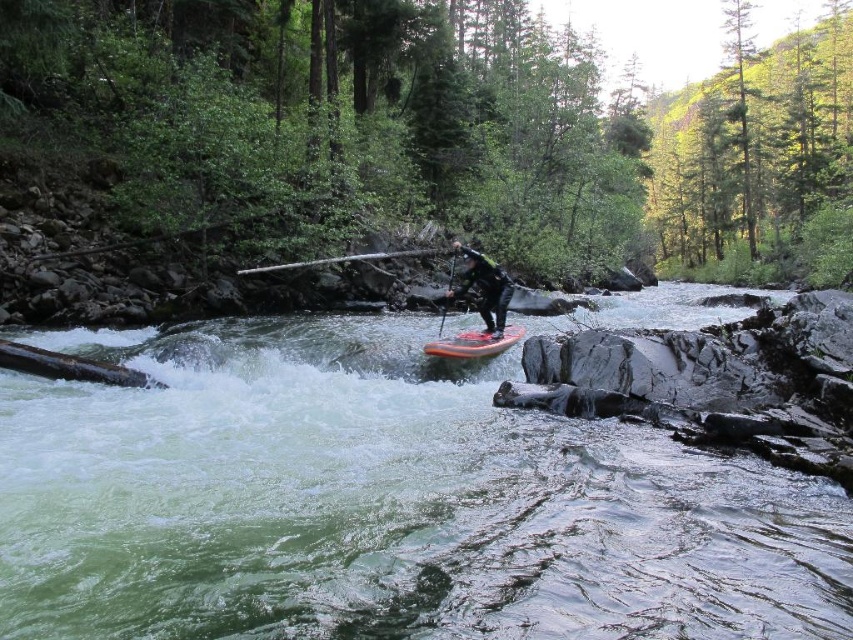
Describe the element at coordinates (485, 288) in the screenshot. I see `black rubber wetsuit at center` at that location.

Is black rubber wetsuit at center closer to the viewer compared to smooth wooden paddle at center?

Yes, black rubber wetsuit at center is in front of smooth wooden paddle at center.

You are a GUI agent. You are given a task and a screenshot of the screen. Output one action in this format:
    pyautogui.click(x=<x>, y=<y>)
    Task: Click on the black rubber wetsuit at center
    This screenshot has height=640, width=853.
    Given the screenshot: What is the action you would take?
    coord(485,288)

Is orange glossy canoe at center thinner than smooth wooden paddle at center?

Yes, orange glossy canoe at center is thinner than smooth wooden paddle at center.

From the picture: Is the position of orange glossy canoe at center less distant than that of smooth wooden paddle at center?

Yes, orange glossy canoe at center is in front of smooth wooden paddle at center.

Does point (482, 355) come in front of point (401, 253)?

Yes, point (482, 355) is closer to viewer.

This screenshot has width=853, height=640. What are the coordinates of `orange glossy canoe at center` in the screenshot? It's located at (474, 342).

Is orange glossy canoe at center shorter than smooth orange paddle at center?

Indeed, orange glossy canoe at center has a lesser height compared to smooth orange paddle at center.

Can you confirm if orange glossy canoe at center is thinner than smooth orange paddle at center?

No, orange glossy canoe at center is not thinner than smooth orange paddle at center.

Describe the element at coordinates (474, 342) in the screenshot. I see `orange glossy canoe at center` at that location.

The width and height of the screenshot is (853, 640). What are the coordinates of `orange glossy canoe at center` in the screenshot? It's located at (474, 342).